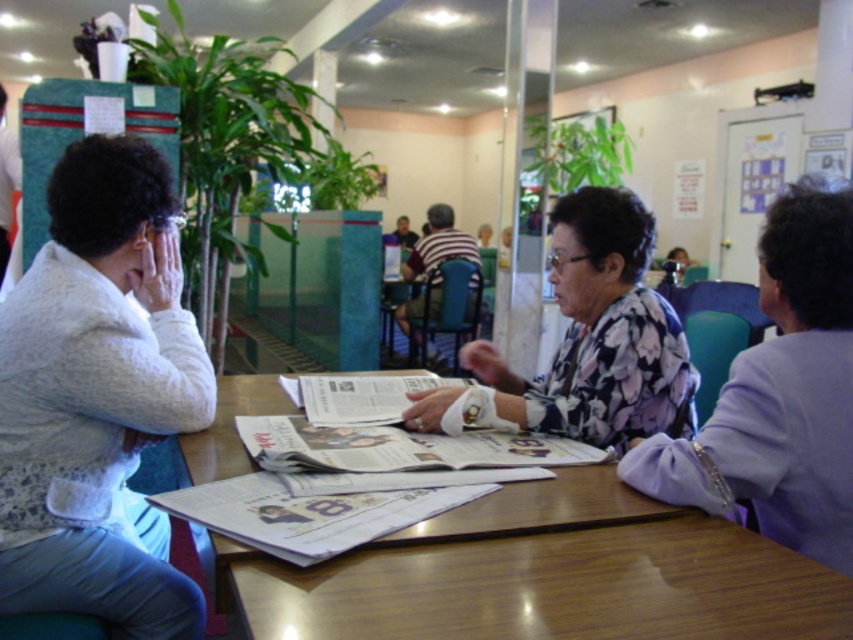
You are a customer at this cafe and want to place an order. You see the wooden table at center and the striped cotton shirt at center. Which object is closer to the floor?

The wooden table at center is shorter than the striped cotton shirt at center, so the wooden table at center is closer to the floor.

You are a photographer setting up for a group photo of the three women at the wooden table at center. To include everyone comfortably in the frame, should you position yourself to the left or right of the floral print blouse at center?

You should position yourself to the right of the floral print blouse at center because the wooden table at center is to the left of the floral print blouse at center, so moving to the right will allow you to capture the entire group comfortably.